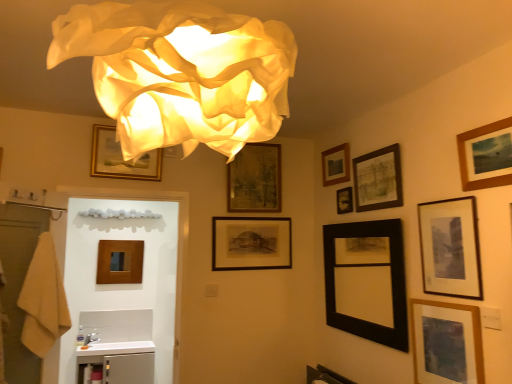
Question: Which direction should I rotate to look at black matte picture frame at center, which is counted as the 9th picture frame, starting from the right, — up or down?

Choices:
 (A) up
 (B) down

Answer: (B)

Question: Is wooden framed picture at upper center, the fourth picture frame positioned from the left, shorter than wooden picture frame at center, marked as the 11th picture frame in a right-to-left arrangement?

Choices:
 (A) no
 (B) yes

Answer: (A)

Question: Can you confirm if wooden framed picture at upper center, the fourth picture frame positioned from the left, is bigger than wooden picture frame at center, the first picture frame from the left?

Choices:
 (A) no
 (B) yes

Answer: (B)

Question: Does wooden framed picture at upper center, the fourth picture frame positioned from the left, have a greater width compared to wooden picture frame at center, marked as the 11th picture frame in a right-to-left arrangement?

Choices:
 (A) yes
 (B) no

Answer: (A)

Question: Is wooden framed picture at upper center, the fourth picture frame positioned from the left, at the left side of wooden picture frame at center, marked as the 11th picture frame in a right-to-left arrangement?

Choices:
 (A) no
 (B) yes

Answer: (A)

Question: From a real-world perspective, is wooden framed picture at upper center, acting as the eighth picture frame starting from the right, beneath wooden picture frame at center, marked as the 11th picture frame in a right-to-left arrangement?

Choices:
 (A) yes
 (B) no

Answer: (B)

Question: Is wooden framed picture at upper center, acting as the eighth picture frame starting from the right, not close to wooden picture frame at center, marked as the 11th picture frame in a right-to-left arrangement?

Choices:
 (A) yes
 (B) no

Answer: (A)

Question: From the image's perspective, is wooden picture frame at center, marked as the 11th picture frame in a right-to-left arrangement, above matte black picture frame at upper right, positioned as the fourth picture frame in right-to-left order?

Choices:
 (A) yes
 (B) no

Answer: (B)

Question: Is matte black picture frame at upper right, positioned as the fourth picture frame in right-to-left order, at the back of wooden picture frame at center, marked as the 11th picture frame in a right-to-left arrangement?

Choices:
 (A) no
 (B) yes

Answer: (A)

Question: Is wooden picture frame at center, marked as the 11th picture frame in a right-to-left arrangement, next to matte black picture frame at upper right, positioned as the fourth picture frame in right-to-left order?

Choices:
 (A) yes
 (B) no

Answer: (B)

Question: Considering the relative sizes of wooden picture frame at center, the first picture frame from the left, and matte black picture frame at upper right, positioned as the 8th picture frame in left-to-right order, in the image provided, is wooden picture frame at center, the first picture frame from the left, shorter than matte black picture frame at upper right, positioned as the 8th picture frame in left-to-right order,?

Choices:
 (A) no
 (B) yes

Answer: (A)

Question: From a real-world perspective, is wooden picture frame at center, marked as the 11th picture frame in a right-to-left arrangement, located higher than matte black picture frame at upper right, positioned as the 8th picture frame in left-to-right order?

Choices:
 (A) no
 (B) yes

Answer: (A)

Question: From the image's perspective, is wooden picture frame at center, the first picture frame from the left, below matte black picture frame at upper right, positioned as the fourth picture frame in right-to-left order?

Choices:
 (A) yes
 (B) no

Answer: (A)

Question: From the image's perspective, is white glossy counter top at lower left below gold-framed picture at upper center, which is the tenth picture frame from right to left?

Choices:
 (A) no
 (B) yes

Answer: (B)